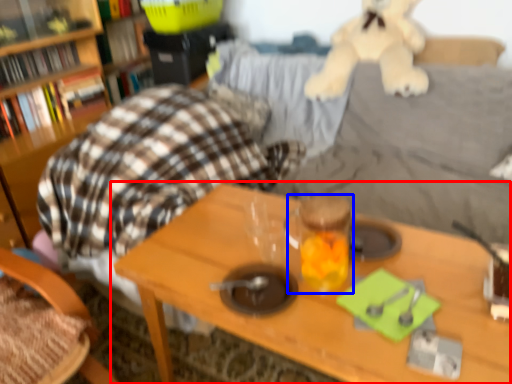
Question: Among these objects, which one is farthest to the camera, table (highlighted by a red box) or beverage (highlighted by a blue box)?

Choices:
 (A) table
 (B) beverage

Answer: (B)